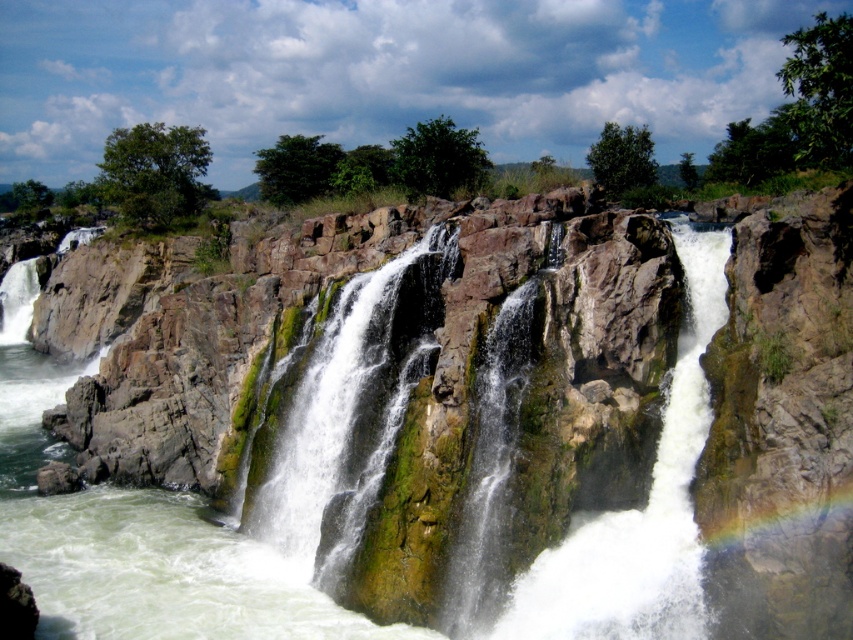
Is brown rough rock at center thinner than green mossy rock at center?

Incorrect, brown rough rock at center's width is not less than green mossy rock at center's.

Can you confirm if brown rough rock at center is bigger than green mossy rock at center?

Correct, brown rough rock at center is larger in size than green mossy rock at center.

The width and height of the screenshot is (853, 640). I want to click on brown rough rock at center, so click(782, 420).